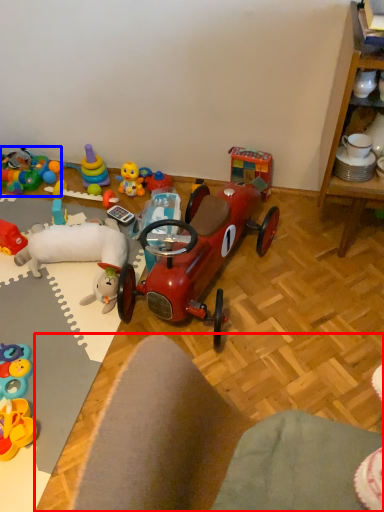
Question: Which object is further to the camera taking this photo, desk (highlighted by a red box) or toy (highlighted by a blue box)?

Choices:
 (A) desk
 (B) toy

Answer: (B)